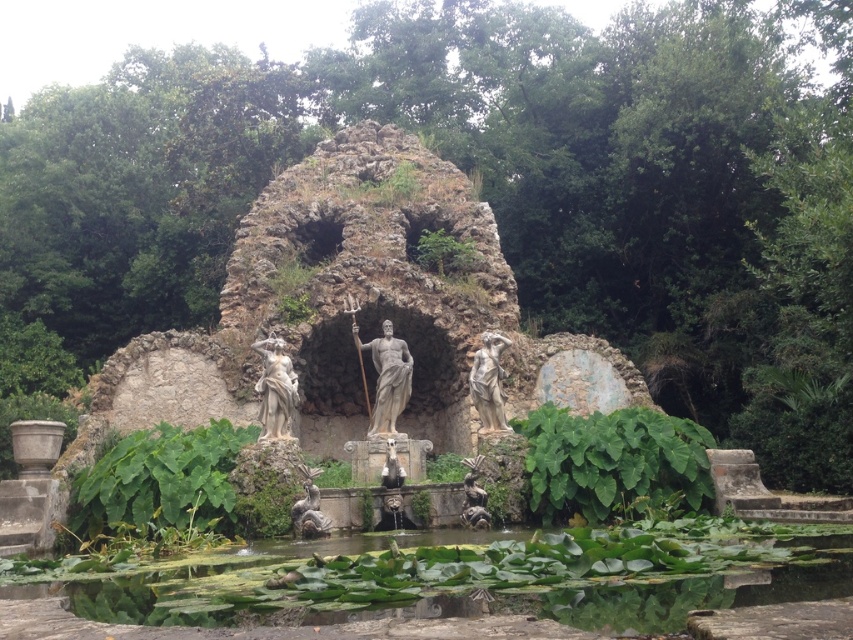
Question: Which of the following is the farthest from the observer?

Choices:
 (A) (383, 323)
 (B) (267, 362)

Answer: (A)

Question: Can you confirm if green leafy pond at center is positioned to the right of white marble statue at center?

Choices:
 (A) no
 (B) yes

Answer: (B)

Question: Can you confirm if white marble statue at center is bigger than matte gray statue at center?

Choices:
 (A) no
 (B) yes

Answer: (B)

Question: Considering the real-world distances, which object is farthest from the white marble statue at center?

Choices:
 (A) matte gray statue at center
 (B) white marble statue at left

Answer: (B)

Question: Which point is closer to the camera taking this photo?

Choices:
 (A) (267, 381)
 (B) (482, 456)

Answer: (B)

Question: Does white marble statue at left appear under polished bronze statue at center?

Choices:
 (A) yes
 (B) no

Answer: (B)